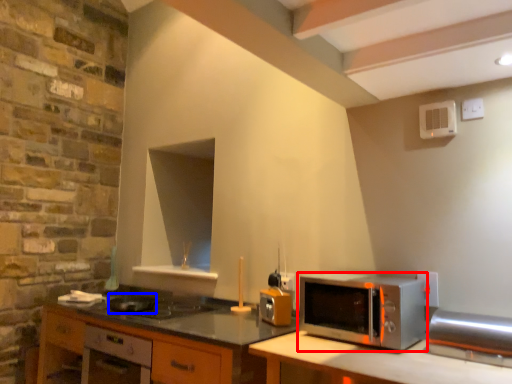
Question: Which of the following is the farthest to the observer, microwave oven (highlighted by a red box) or appliance (highlighted by a blue box)?

Choices:
 (A) microwave oven
 (B) appliance

Answer: (B)